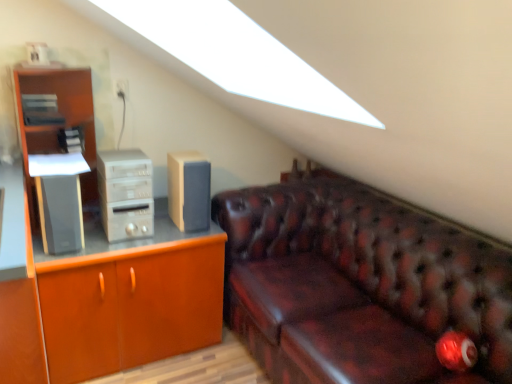
Question: Which is correct: satin black speaker at left, the 1th speaker in the left-to-right sequence, is inside matte wood cabinet at left, or outside of it?

Choices:
 (A) outside
 (B) inside

Answer: (A)

Question: Considering the relative positions of satin black speaker at left, the 1th speaker in the left-to-right sequence, and matte wood cabinet at left in the image provided, is satin black speaker at left, the 1th speaker in the left-to-right sequence, to the left or to the right of matte wood cabinet at left?

Choices:
 (A) right
 (B) left

Answer: (B)

Question: Which object is positioned farthest from the leather couch at right?

Choices:
 (A) satin black speaker at left, which is counted as the second speaker, starting from the right
 (B) beige fabric speaker at center, which is the first speaker from right to left
 (C) satin silver computer tower at left
 (D) matte wood cabinet at left

Answer: (A)

Question: Which object is positioned farthest from the leather couch at right?

Choices:
 (A) beige fabric speaker at center, which is the first speaker from right to left
 (B) satin silver computer tower at left
 (C) satin black speaker at left, which is counted as the second speaker, starting from the right
 (D) matte wood cabinet at left

Answer: (C)